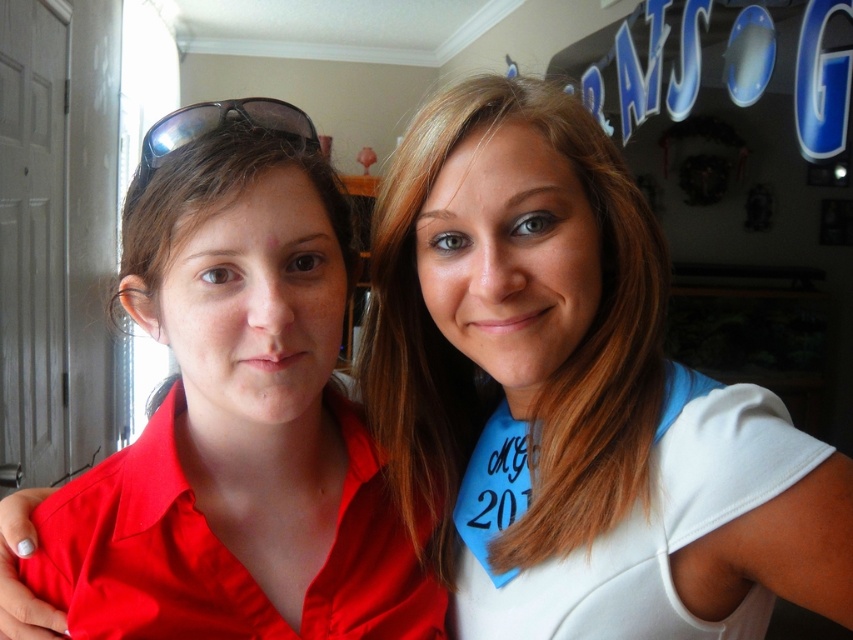
Question: Is white matte shirt at upper right in front of sunglasses at left?

Choices:
 (A) no
 (B) yes

Answer: (B)

Question: Is the position of matte red shirt at left less distant than that of sunglasses at left?

Choices:
 (A) yes
 (B) no

Answer: (A)

Question: Among these objects, which one is farthest from the camera?

Choices:
 (A) sunglasses at left
 (B) matte red shirt at left

Answer: (A)

Question: Where is white matte shirt at upper right located in relation to sunglasses at left in the image?

Choices:
 (A) below
 (B) above

Answer: (A)

Question: Which object is positioned farthest from the white matte shirt at upper right?

Choices:
 (A) matte red shirt at left
 (B) sunglasses at left

Answer: (B)

Question: Which of the following is the farthest from the observer?

Choices:
 (A) (289, 140)
 (B) (438, 410)

Answer: (B)